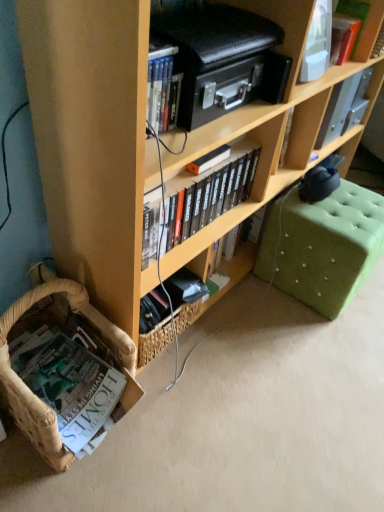
The width and height of the screenshot is (384, 512). Find the location of `free space between green tufted ottoman at lower right and white paper book at lower left, the 3th book when ordered from top to bottom`. free space between green tufted ottoman at lower right and white paper book at lower left, the 3th book when ordered from top to bottom is located at coordinates (239, 344).